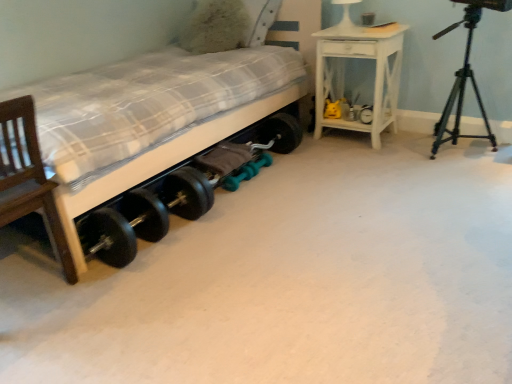
Find the location of `free space in front of black metal tripod at right`. free space in front of black metal tripod at right is located at coordinates 472,178.